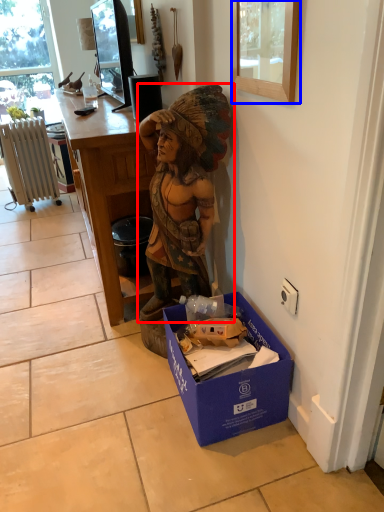
Question: Which object is further to the camera taking this photo, person (highlighted by a red box) or picture frame (highlighted by a blue box)?

Choices:
 (A) person
 (B) picture frame

Answer: (A)